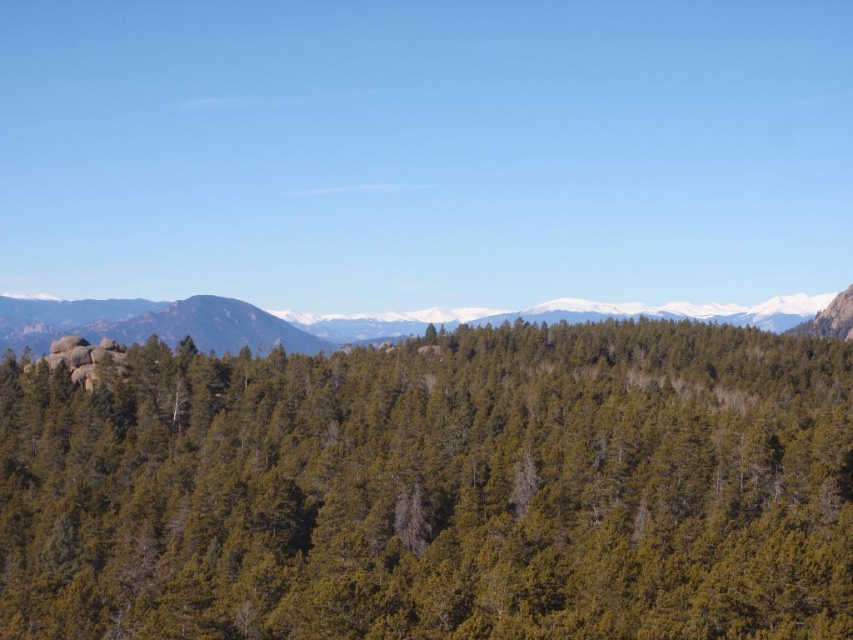
Does green matte tree at center have a greater width compared to green forested hillside at center?

Incorrect, green matte tree at center's width does not surpass green forested hillside at center's.

Can you confirm if green matte tree at center is positioned above green forested hillside at center?

No.

Image resolution: width=853 pixels, height=640 pixels. Find the location of `green matte tree at center`. green matte tree at center is located at coordinates (437, 490).